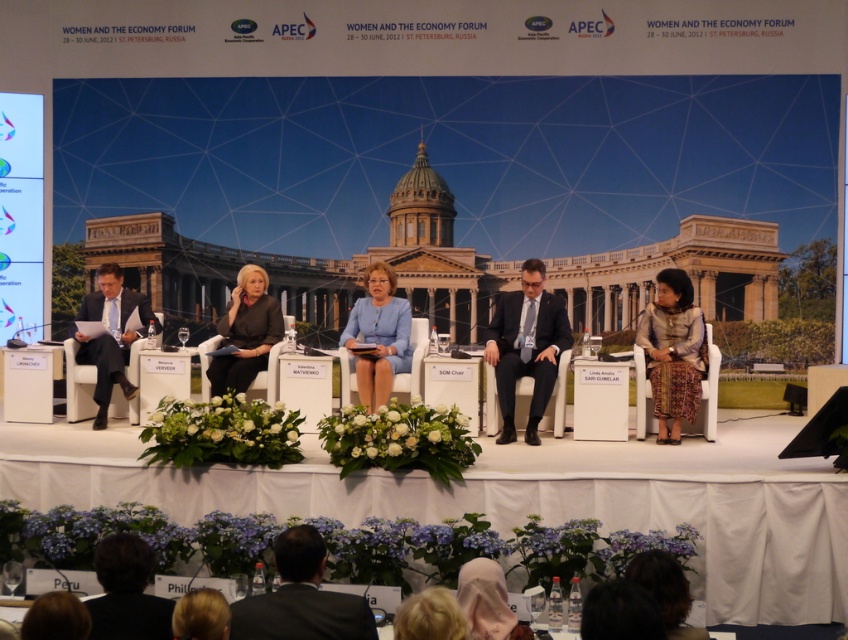
You are an attendee at the Women and the Economy Forum in St. Petersburg. You are standing in the audience and see two points on the stage. The first point is at coordinates point (672, 296) and the second is at point (254, 324). Which point is closer to you?

Point (672, 296) is closer to you than point (254, 324).

You are an event organizer and need to adjust seating arrangements to accommodate a larger group. The silk skirt at right and dark gray suit at center are currently seated. Which attendee should you move to a narrower seat to save space?

The silk skirt at right should be moved to a narrower seat since it has a lesser width compared to the dark gray suit at center, allowing more space for additional attendees.

You are organizing a photoshoot for a fashion magazine and need to decide which garment to feature based on their width. The scene shows a silk skirt at right and a blue fabric dress at center. According to the description, which garment might have a wider silhouette?

The silk skirt at right might be wider than the blue fabric dress at center, so the silk skirt at right could have a wider silhouette.